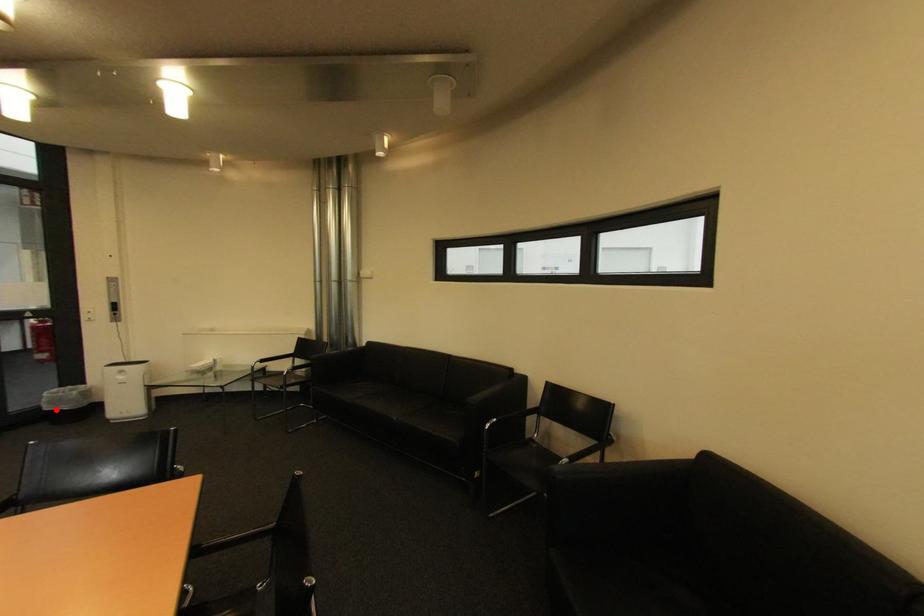
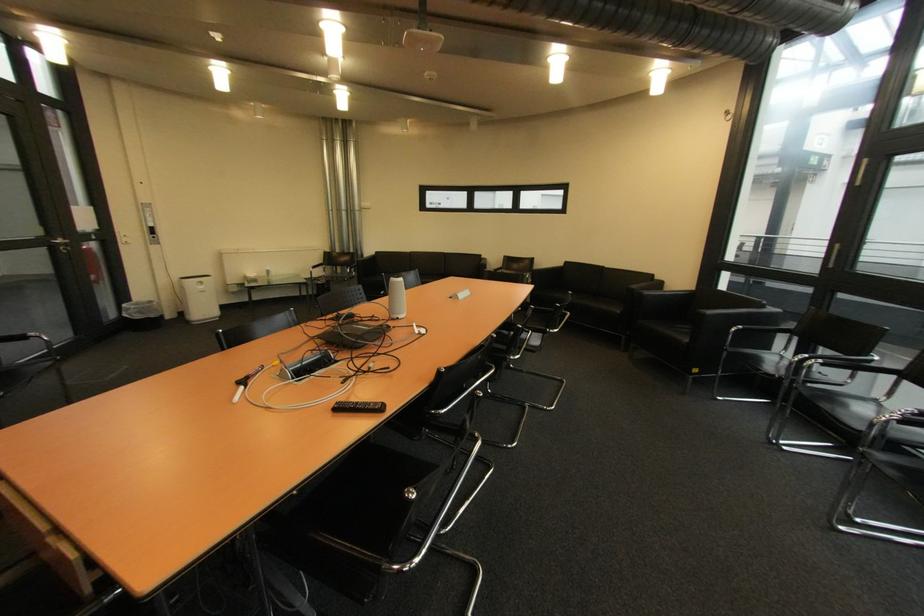
Find the pixel in the second image that matches the highlighted location in the first image.

(147, 318)